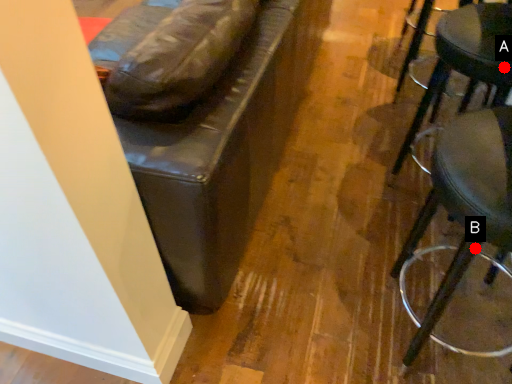
Question: Two points are circled on the image, labeled by A and B beside each circle. Which point is further to the camera?

Choices:
 (A) A is further
 (B) B is further

Answer: (A)